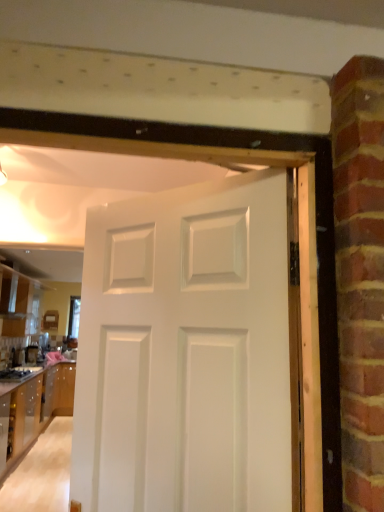
Question: Considering the relative sizes of satin black coffee maker at lower left and glossy wood cabinetry at left, the 1th cabinetry in the top-to-bottom sequence, in the image provided, is satin black coffee maker at lower left shorter than glossy wood cabinetry at left, the 1th cabinetry in the top-to-bottom sequence,?

Choices:
 (A) yes
 (B) no

Answer: (A)

Question: From a real-world perspective, is satin black coffee maker at lower left beneath glossy wood cabinetry at left, the 2th cabinetry ordered from the bottom?

Choices:
 (A) no
 (B) yes

Answer: (B)

Question: Does satin black coffee maker at lower left appear on the left side of glossy wood cabinetry at left, the 1th cabinetry in the top-to-bottom sequence?

Choices:
 (A) no
 (B) yes

Answer: (B)

Question: Can you confirm if satin black coffee maker at lower left is wider than glossy wood cabinetry at left, the 2th cabinetry ordered from the bottom?

Choices:
 (A) no
 (B) yes

Answer: (A)

Question: Is satin black coffee maker at lower left in contact with glossy wood cabinetry at left, the 1th cabinetry in the top-to-bottom sequence?

Choices:
 (A) no
 (B) yes

Answer: (A)

Question: Is satin black coffee maker at lower left closer to camera compared to glossy wood cabinetry at left, the 1th cabinetry in the top-to-bottom sequence?

Choices:
 (A) yes
 (B) no

Answer: (B)

Question: Considering the relative positions of satin black coffee maker at lower left and white matte door at center in the image provided, is satin black coffee maker at lower left to the left of white matte door at center from the viewer's perspective?

Choices:
 (A) no
 (B) yes

Answer: (B)

Question: Would you say satin black coffee maker at lower left is outside white matte door at center?

Choices:
 (A) yes
 (B) no

Answer: (A)

Question: Is there a large distance between satin black coffee maker at lower left and white matte door at center?

Choices:
 (A) yes
 (B) no

Answer: (A)

Question: Considering the relative sizes of satin black coffee maker at lower left and white matte door at center in the image provided, is satin black coffee maker at lower left bigger than white matte door at center?

Choices:
 (A) no
 (B) yes

Answer: (A)

Question: Is satin black coffee maker at lower left aimed at white matte door at center?

Choices:
 (A) yes
 (B) no

Answer: (B)

Question: From a real-world perspective, is satin black coffee maker at lower left located beneath white matte door at center?

Choices:
 (A) no
 (B) yes

Answer: (B)

Question: Is the position of white matte door at center less distant than that of wooden cabinet at lower left, acting as the 1th cabinetry starting from the bottom?

Choices:
 (A) yes
 (B) no

Answer: (A)